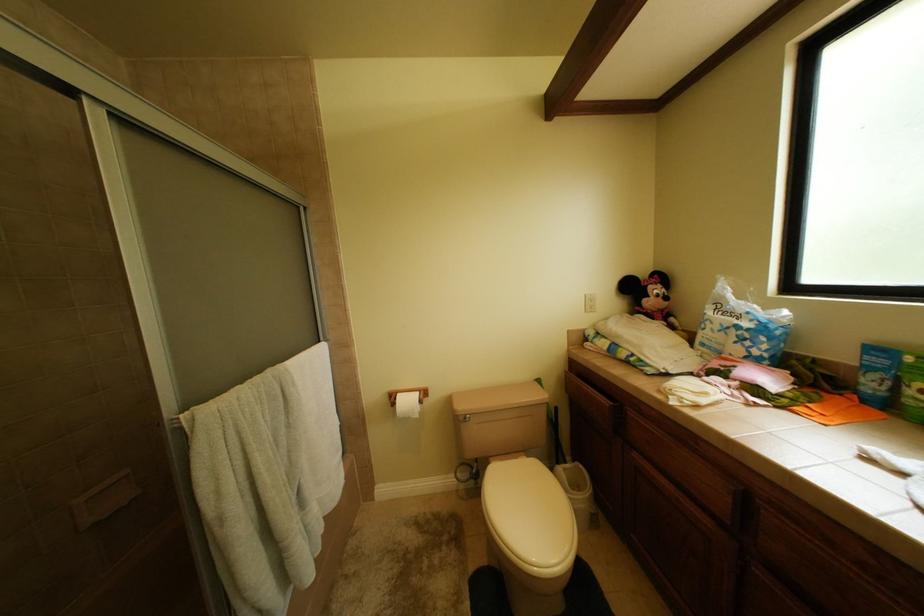
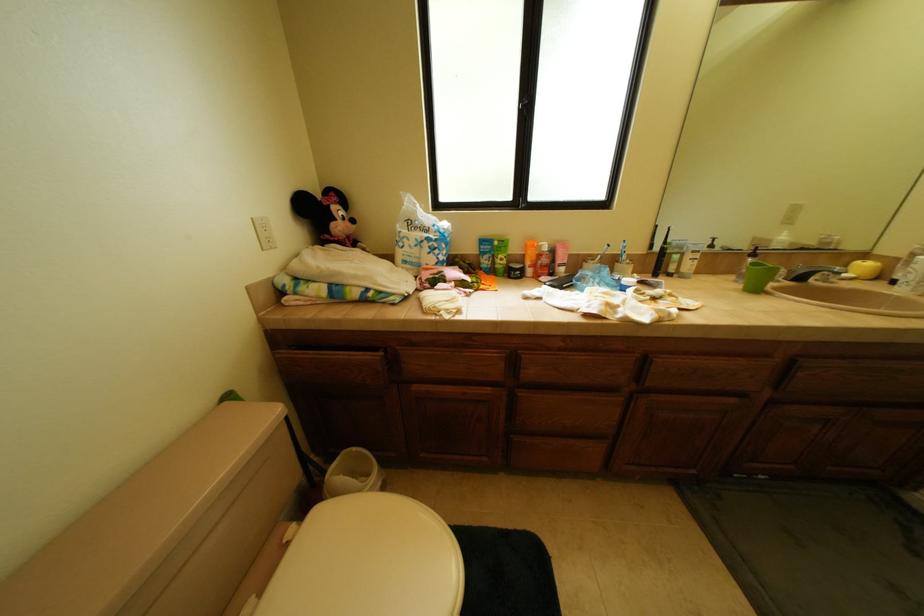
Based on the continuous images, in which direction is the camera rotating?

The camera's rotation is toward right-down.